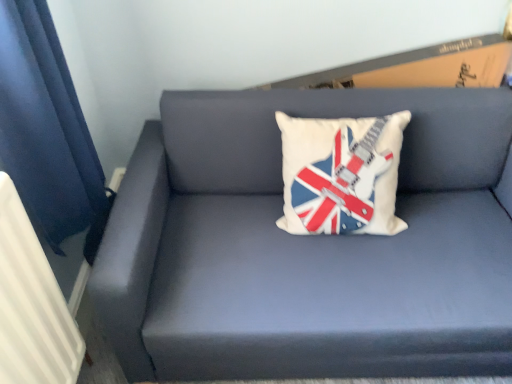
Question: Considering the positions of point (484, 97) and point (16, 253), is point (484, 97) closer or farther from the camera than point (16, 253)?

Choices:
 (A) closer
 (B) farther

Answer: (B)

Question: In terms of width, does matte blue couch at center look wider or thinner when compared to white textured radiator at left?

Choices:
 (A) wide
 (B) thin

Answer: (A)

Question: Estimate the real-world distances between objects in this image. Which object is farther from the white fabric pillow with guitar and flag design at center?

Choices:
 (A) white textured radiator at left
 (B) matte blue couch at center

Answer: (A)

Question: Which of these objects is positioned closest to the white fabric pillow with guitar and flag design at center?

Choices:
 (A) white textured radiator at left
 (B) matte blue couch at center

Answer: (B)